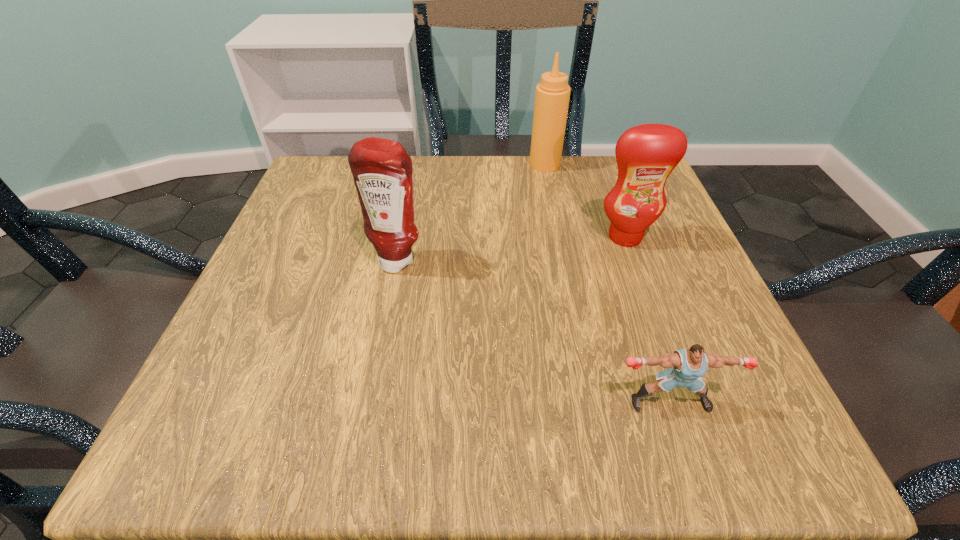
Find the location of a particular element. The width and height of the screenshot is (960, 540). vacant space that's between the puncher and the leftmost condiment is located at coordinates (534, 331).

Where is `free space between the leftmost condiment and the rightmost condiment`? The height and width of the screenshot is (540, 960). free space between the leftmost condiment and the rightmost condiment is located at coordinates (512, 248).

What are the coordinates of `free point between the farthest condiment and the leftmost condiment` in the screenshot? It's located at (471, 212).

Select which object appears as the second closest to the shortest object. Please provide its 2D coordinates. Your answer should be formatted as a tuple, i.e. [(x, y)], where the tuple contains the x and y coordinates of a point satisfying the conditions above.

[(382, 170)]

Find the location of a particular element. object identified as the second closest to the farthest condiment is located at coordinates (382, 170).

Locate which condiment ranks in proximity to the leftmost object. Please provide its 2D coordinates. Your answer should be formatted as a tuple, i.e. [(x, y)], where the tuple contains the x and y coordinates of a point satisfying the conditions above.

[(646, 154)]

Identify which condiment is located as the nearest to the nearest object. Please provide its 2D coordinates. Your answer should be formatted as a tuple, i.e. [(x, y)], where the tuple contains the x and y coordinates of a point satisfying the conditions above.

[(646, 154)]

This screenshot has height=540, width=960. In order to click on blank area in the image that satisfies the following two spatial constraints: 1. on the back side of the leftmost condiment; 2. on the left side of the farthest condiment in this screenshot , I will do `click(417, 164)`.